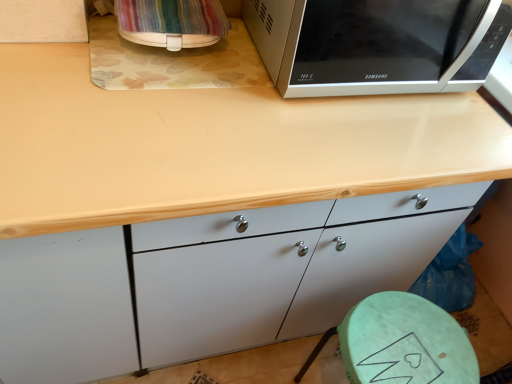
The width and height of the screenshot is (512, 384). I want to click on vacant space that is in between striped fabric bag at upper left and sleek silver microwave at upper right, so click(x=231, y=72).